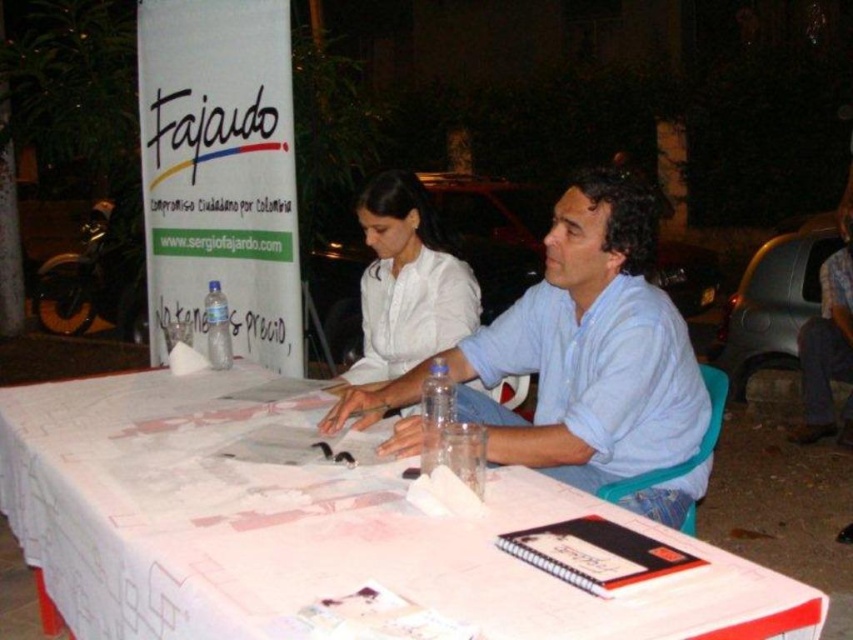
You are a photographer standing in front of the table. You want to take a photo of the white paper at center and the light blue shirt at center. Which object will appear larger in the photo?

The white paper at center will appear larger in the photo because it is closer to the viewer than the light blue shirt at center.

Please provide the 2D coordinates of the light blue shirt at center as observed in the scene.

The 2D coordinates of the light blue shirt at center are at point [590,348].

You are a photographer trying to capture a closeup of the white paper at center and the light blue shirt at center. Which object should you zoom in on first to ensure it fits entirely in the frame?

The white paper at center is shorter than the light blue shirt at center, so you should zoom in on the white paper at center first to ensure it fits entirely in the frame.